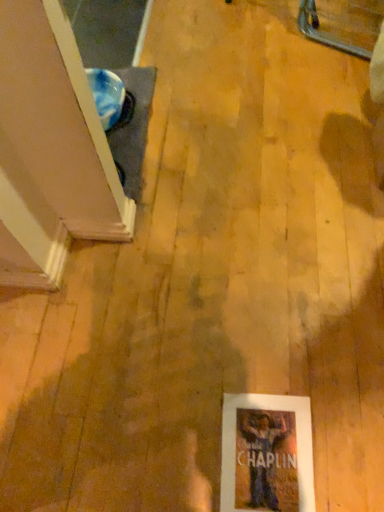
Where is `white paper poster at lower center`? This screenshot has width=384, height=512. white paper poster at lower center is located at coordinates (266, 454).

What do you see at coordinates (266, 454) in the screenshot? I see `white paper poster at lower center` at bounding box center [266, 454].

Looking at this image, measure the distance between white paper poster at lower center and camera.

A distance of 37.06 inches exists between white paper poster at lower center and camera.

Where is `white paper poster at lower center`? This screenshot has width=384, height=512. white paper poster at lower center is located at coordinates (266, 454).